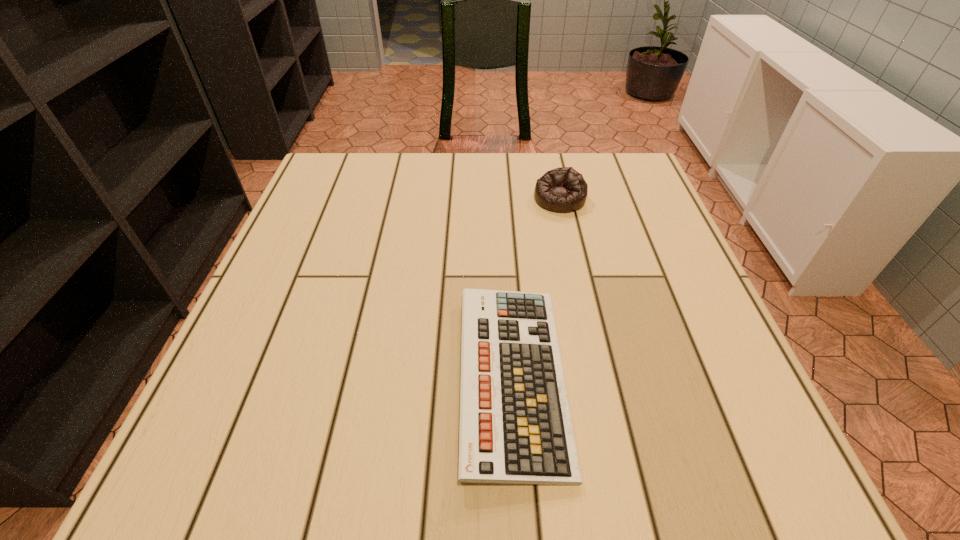
You are a GUI agent. You are given a task and a screenshot of the screen. Output one action in this format:
    pyautogui.click(x=<x>, y=<y>)
    Task: Click on the free space at the left edge of the desktop
    The height and width of the screenshot is (540, 960).
    Given the screenshot: What is the action you would take?
    pyautogui.click(x=309, y=209)

The height and width of the screenshot is (540, 960). In order to click on vacant space at the right edge in this screenshot , I will do `click(653, 253)`.

Identify the location of free space at the far left corner. (368, 177).

Where is `vacant space at the near left corner of the desktop`? The width and height of the screenshot is (960, 540). vacant space at the near left corner of the desktop is located at coordinates (220, 463).

Identify the location of vacant space at the far right corner of the desktop. The height and width of the screenshot is (540, 960). (647, 188).

Where is `free space that satisfies the following two spatial constraints: 1. on the back side of the farther object; 2. on the right side of the computer keyboard`? free space that satisfies the following two spatial constraints: 1. on the back side of the farther object; 2. on the right side of the computer keyboard is located at coordinates (502, 199).